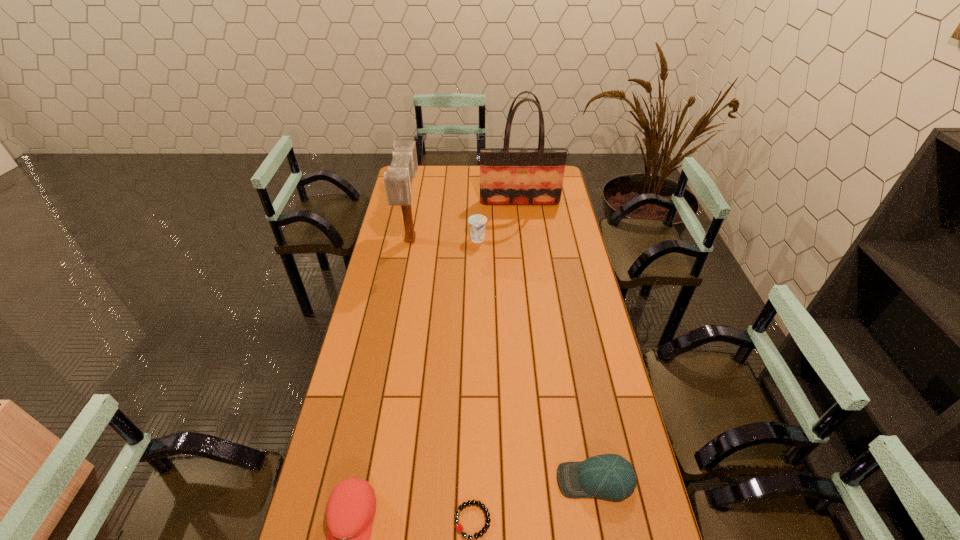
The height and width of the screenshot is (540, 960). Identify the location of shopping bag present at the right edge. (508, 176).

The height and width of the screenshot is (540, 960). What are the coordinates of `baseball cap that is at the right edge` in the screenshot? It's located at (611, 477).

Identify the location of vacant region at the far edge of the desktop. The width and height of the screenshot is (960, 540). (436, 181).

In the image, there is a desktop. At what (x,y) coordinates should I click in order to perform the action: click on vacant space at the left edge. Please return your answer as a coordinate pair (x, y). Looking at the image, I should click on (379, 302).

Find the location of a particular element. This screenshot has height=540, width=960. vacant space at the right edge is located at coordinates tap(551, 228).

This screenshot has width=960, height=540. Identify the location of vacant space at the far left corner of the desktop. (425, 183).

Image resolution: width=960 pixels, height=540 pixels. What are the coordinates of `free space that is in between the yogurt and the farthest object` in the screenshot? It's located at (499, 221).

Find the location of a particular element. This screenshot has width=960, height=540. empty location between the second tallest object and the fourth shortest object is located at coordinates (444, 240).

Locate an element on the screen. The width and height of the screenshot is (960, 540). vacant area that lies between the yogurt and the fifth shortest object is located at coordinates (444, 240).

The image size is (960, 540). I want to click on empty space that is in between the tallest object and the fourth shortest object, so click(x=499, y=221).